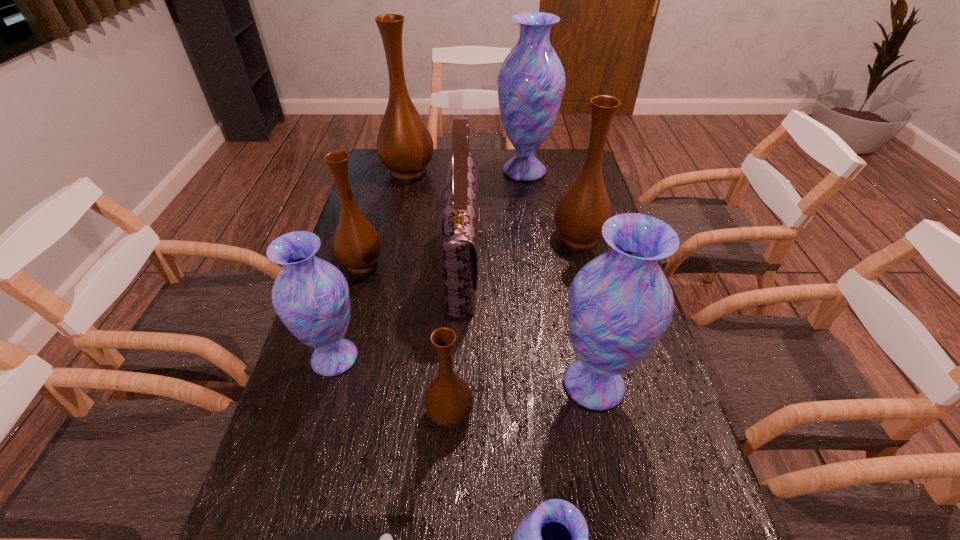
The image size is (960, 540). Find the location of `free spot located on the front of the farthest brown vase`. free spot located on the front of the farthest brown vase is located at coordinates (399, 210).

Locate an element on the screen. The width and height of the screenshot is (960, 540). vacant space located 0.190m on the front of the handbag with the clasp is located at coordinates (544, 265).

In order to click on free location located on the left of the third smallest brown vase in this screenshot , I will do `click(432, 237)`.

Where is `free region located 0.290m on the back of the second biggest purple vase`? This screenshot has width=960, height=540. free region located 0.290m on the back of the second biggest purple vase is located at coordinates (570, 272).

Locate an element on the screen. vacant space situated 0.290m on the back of the second smallest brown vase is located at coordinates (381, 197).

Image resolution: width=960 pixels, height=540 pixels. I want to click on vacant area situated 0.250m on the front of the second smallest purple vase, so click(295, 497).

Where is `free space located 0.100m on the back of the nearest brown vase`? The height and width of the screenshot is (540, 960). free space located 0.100m on the back of the nearest brown vase is located at coordinates (453, 356).

You are a GUI agent. You are given a task and a screenshot of the screen. Output one action in this format:
    pyautogui.click(x=<x>, y=<y>)
    Task: Click on the object at the far left corner
    This screenshot has height=540, width=960.
    Given the screenshot: What is the action you would take?
    pyautogui.click(x=405, y=146)

Where is `object that is positioned at the far right corner`? This screenshot has height=540, width=960. object that is positioned at the far right corner is located at coordinates (531, 81).

I want to click on vacant space at the left edge of the desktop, so click(312, 512).